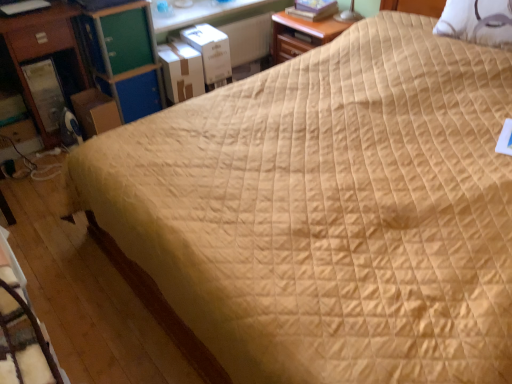
Question: From a real-world perspective, is white cardboard box at upper left, the 2th cardboard box in the left-to-right sequence, below green plastic file cabinet at upper left?

Choices:
 (A) yes
 (B) no

Answer: (A)

Question: Could you tell me if white cardboard box at upper left, the 2th cardboard box in the left-to-right sequence, is facing green plastic file cabinet at upper left?

Choices:
 (A) yes
 (B) no

Answer: (B)

Question: Is white cardboard box at upper left, arranged as the second cardboard box when viewed from the right, bigger than green plastic file cabinet at upper left?

Choices:
 (A) yes
 (B) no

Answer: (B)

Question: Is white cardboard box at upper left, arranged as the second cardboard box when viewed from the right, in front of green plastic file cabinet at upper left?

Choices:
 (A) no
 (B) yes

Answer: (A)

Question: From the image's perspective, is white cardboard box at upper left, the 2th cardboard box in the left-to-right sequence, on top of green plastic file cabinet at upper left?

Choices:
 (A) yes
 (B) no

Answer: (A)

Question: From a real-world perspective, is white cardboard box at upper left, arranged as the second cardboard box when viewed from the right, over green plastic file cabinet at upper left?

Choices:
 (A) yes
 (B) no

Answer: (B)

Question: Is brown cardboard box at left, which is the first cardboard box in left-to-right order, closer to the viewer compared to white cardboard box at upper left, arranged as the second cardboard box when viewed from the right?

Choices:
 (A) yes
 (B) no

Answer: (A)

Question: Is brown cardboard box at left, which ranks as the 3th cardboard box in right-to-left order, oriented towards white cardboard box at upper left, arranged as the second cardboard box when viewed from the right?

Choices:
 (A) no
 (B) yes

Answer: (A)

Question: Is brown cardboard box at left, which is the first cardboard box in left-to-right order, far away from white cardboard box at upper left, the 2th cardboard box in the left-to-right sequence?

Choices:
 (A) no
 (B) yes

Answer: (A)

Question: Is brown cardboard box at left, which ranks as the 3th cardboard box in right-to-left order, oriented away from white cardboard box at upper left, the 2th cardboard box in the left-to-right sequence?

Choices:
 (A) no
 (B) yes

Answer: (A)

Question: Does brown cardboard box at left, which is the first cardboard box in left-to-right order, have a greater height compared to white cardboard box at upper left, arranged as the second cardboard box when viewed from the right?

Choices:
 (A) no
 (B) yes

Answer: (B)

Question: Can you confirm if brown cardboard box at left, which is the first cardboard box in left-to-right order, is smaller than white cardboard box at upper left, the 2th cardboard box in the left-to-right sequence?

Choices:
 (A) yes
 (B) no

Answer: (A)

Question: Is white textured pillow at upper right looking in the opposite direction of brown cardboard box at left, which is the first cardboard box in left-to-right order?

Choices:
 (A) yes
 (B) no

Answer: (B)